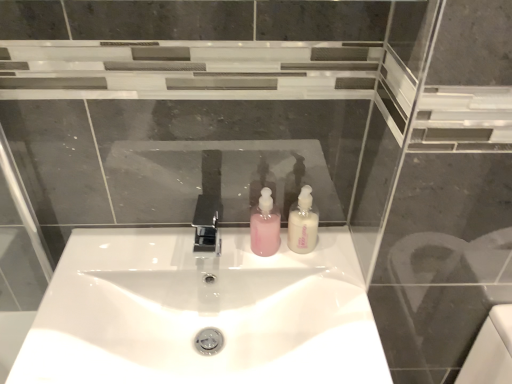
Locate an element on the screen. The width and height of the screenshot is (512, 384). vacant area that is situated to the right of white glossy soap dispenser at center, the 2th soap dispenser in the left-to-right sequence is located at coordinates (336, 251).